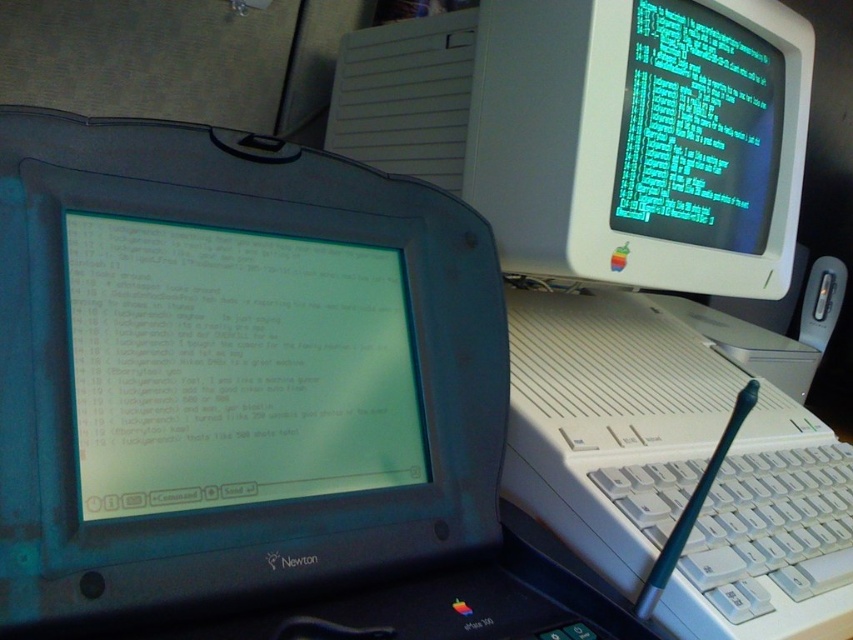
Question: Does teal plastic newton pda at center have a greater width compared to white plastic desktop computer at upper center?

Choices:
 (A) yes
 (B) no

Answer: (B)

Question: In this image, where is white plastic desktop computer at upper center located relative to white plastic monitor at upper right?

Choices:
 (A) above
 (B) below

Answer: (B)

Question: Which of the following is the farthest from the observer?

Choices:
 (A) (525, 170)
 (B) (415, 384)

Answer: (A)

Question: Which point is farther from the camera taking this photo?

Choices:
 (A) (552, 204)
 (B) (244, 192)
 (C) (300, 387)
 (D) (503, 225)

Answer: (D)

Question: Which point appears closest to the camera in this image?

Choices:
 (A) pos(422,458)
 (B) pos(537,68)

Answer: (A)

Question: Is teal plastic newton pda at center bigger than white plastic monitor at upper right?

Choices:
 (A) no
 (B) yes

Answer: (A)